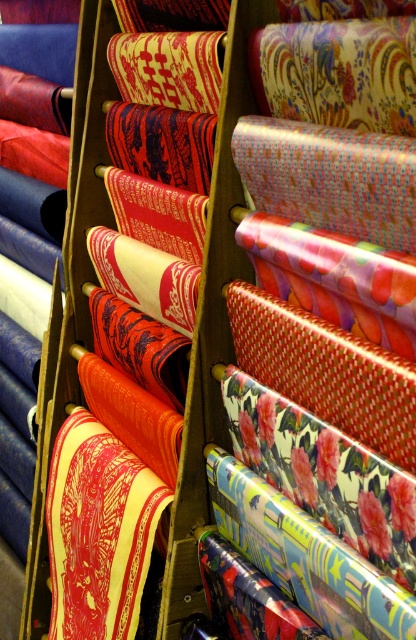
Question: Does yellowmattefabric at center have a smaller size compared to shiny red fabric at center?

Choices:
 (A) no
 (B) yes

Answer: (A)

Question: Is yellowmattefabric at center positioned behind shiny red fabric at center?

Choices:
 (A) yes
 (B) no

Answer: (B)

Question: Which point appears farthest from the camera in this image?

Choices:
 (A) (140, 358)
 (B) (121, 518)

Answer: (A)

Question: Which point is closer to the camera?

Choices:
 (A) shiny red fabric at center
 (B) yellowmattefabric at center

Answer: (B)

Question: Is yellowmattefabric at center positioned in front of shiny red fabric at center?

Choices:
 (A) no
 (B) yes

Answer: (B)